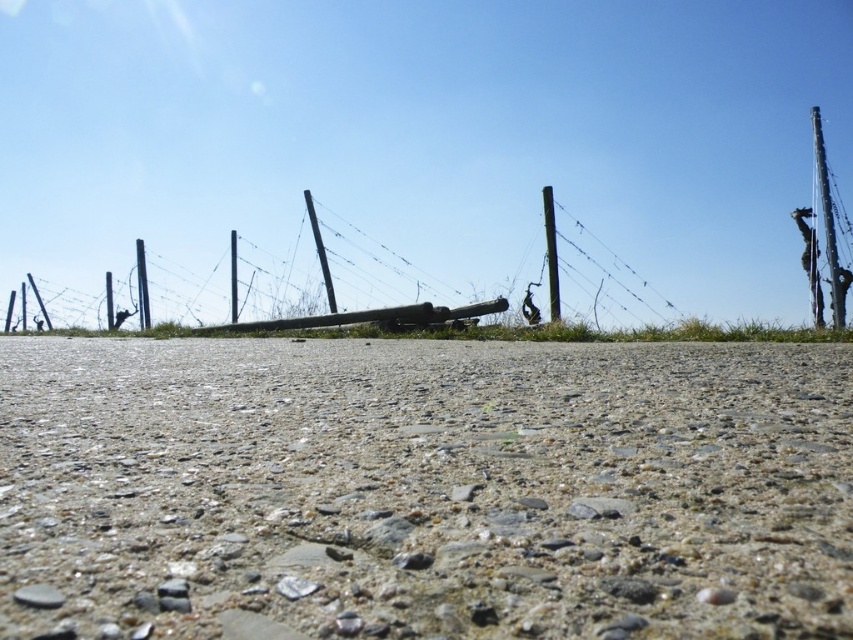
Question: Which of the following is the closest to the observer?

Choices:
 (A) (305, 193)
 (B) (556, 276)
 (C) (236, 276)
 (D) (376, 314)

Answer: (D)

Question: Does wire mesh fence at center appear on the right side of smooth wooden pole at center?

Choices:
 (A) yes
 (B) no

Answer: (A)

Question: Which point is farther to the camera?

Choices:
 (A) (402, 324)
 (B) (332, 285)

Answer: (B)

Question: Does smooth wooden telegraph pole at center have a lesser width compared to smooth wood pole at center?

Choices:
 (A) no
 (B) yes

Answer: (A)

Question: Is smooth wooden telegraph pole at center smaller than smooth wood pole at center?

Choices:
 (A) no
 (B) yes

Answer: (A)

Question: Among these points, which one is farthest from the camera?

Choices:
 (A) (482, 310)
 (B) (547, 195)
 (C) (236, 298)

Answer: (C)